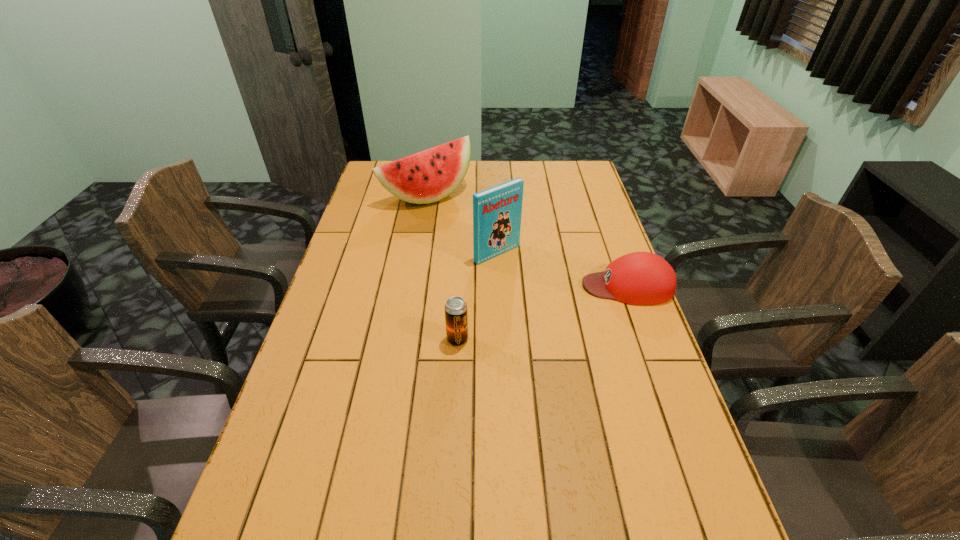
The width and height of the screenshot is (960, 540). What are the coordinates of `free point that satisfies the following two spatial constraints: 1. on the front side of the third farthest object; 2. on the front-facing side of the third object from left to right` in the screenshot? It's located at (498, 286).

In order to click on free space that satisfies the following two spatial constraints: 1. on the back side of the rightmost object; 2. on the front-facing side of the nearest object in this screenshot , I will do `click(460, 286)`.

The height and width of the screenshot is (540, 960). Find the location of `vacant point that satisfies the following two spatial constraints: 1. on the front side of the second tallest object; 2. on the left side of the book`. vacant point that satisfies the following two spatial constraints: 1. on the front side of the second tallest object; 2. on the left side of the book is located at coordinates (418, 254).